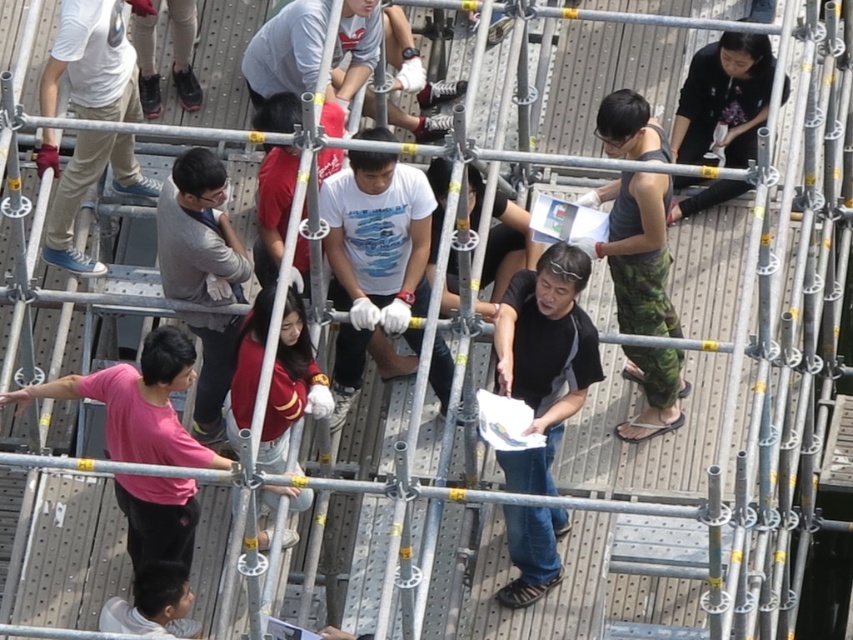
What do you see at coordinates (544, 356) in the screenshot?
I see `black matte shirt at center` at bounding box center [544, 356].

Does black matte shirt at center lie behind black shirt at center?

No, black matte shirt at center is closer to the viewer.

The image size is (853, 640). I want to click on black matte shirt at center, so click(544, 356).

You are a GUI agent. You are given a task and a screenshot of the screen. Output one action in this format:
    pyautogui.click(x=<x>, y=<y>)
    Task: Click on the black matte shirt at center
    This screenshot has width=853, height=640.
    Given the screenshot: What is the action you would take?
    pyautogui.click(x=544, y=356)

Between camouflage pants at right and maroon fabric shirt at center, which one has less height?

camouflage pants at right is shorter.

Is camouflage pants at right positioned behind maroon fabric shirt at center?

Yes, it is behind maroon fabric shirt at center.

What do you see at coordinates (637, 250) in the screenshot?
I see `camouflage pants at right` at bounding box center [637, 250].

I want to click on camouflage pants at right, so click(637, 250).

Is black matte shirt at center shorter than matte white sneakers at upper left?

No.

Can you confirm if black matte shirt at center is positioned above matte white sneakers at upper left?

No, black matte shirt at center is not above matte white sneakers at upper left.

What do you see at coordinates (544, 356) in the screenshot?
I see `black matte shirt at center` at bounding box center [544, 356].

The height and width of the screenshot is (640, 853). I want to click on black matte shirt at center, so click(x=544, y=356).